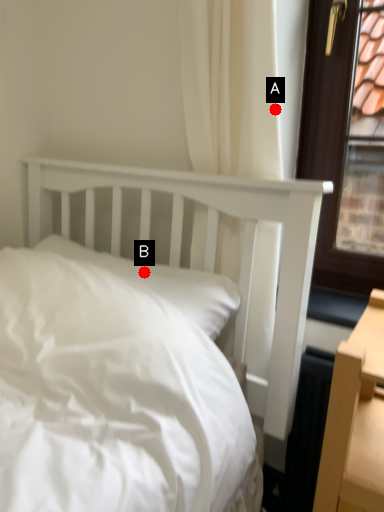
Question: Two points are circled on the image, labeled by A and B beside each circle. Which of the following is the farthest from the observer?

Choices:
 (A) A is further
 (B) B is further

Answer: (B)